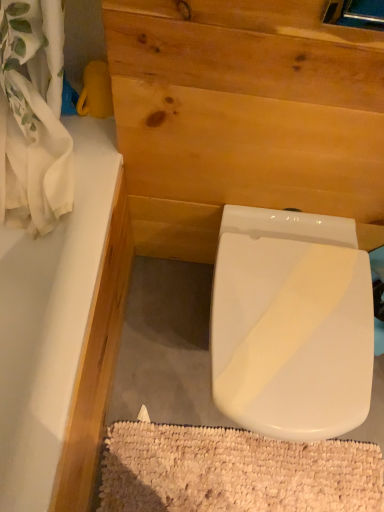
Question: From the image's perspective, is white textured bath mat at lower center located beneath natural wood plywood at center?

Choices:
 (A) no
 (B) yes

Answer: (B)

Question: Is white textured bath mat at lower center to the left of natural wood plywood at center from the viewer's perspective?

Choices:
 (A) yes
 (B) no

Answer: (A)

Question: Can you confirm if white textured bath mat at lower center is bigger than natural wood plywood at center?

Choices:
 (A) yes
 (B) no

Answer: (B)

Question: Does white textured bath mat at lower center have a greater height compared to natural wood plywood at center?

Choices:
 (A) no
 (B) yes

Answer: (A)

Question: Does white textured bath mat at lower center have a lesser height compared to natural wood plywood at center?

Choices:
 (A) yes
 (B) no

Answer: (A)

Question: From the image's perspective, is white glossy bathtub at upper left positioned above or below white textured bath mat at lower center?

Choices:
 (A) below
 (B) above

Answer: (B)

Question: Would you say white glossy bathtub at upper left is inside or outside white textured bath mat at lower center?

Choices:
 (A) outside
 (B) inside

Answer: (A)

Question: From a real-world perspective, is white glossy bathtub at upper left physically located above or below white textured bath mat at lower center?

Choices:
 (A) below
 (B) above

Answer: (B)

Question: Is white glossy bathtub at upper left wider or thinner than white textured bath mat at lower center?

Choices:
 (A) thin
 (B) wide

Answer: (B)

Question: Is natural wood plywood at center taller or shorter than white glossy bathtub at upper left?

Choices:
 (A) tall
 (B) short

Answer: (A)

Question: From a real-world perspective, is natural wood plywood at center above or below white glossy bathtub at upper left?

Choices:
 (A) below
 (B) above

Answer: (B)

Question: Considering their positions, is natural wood plywood at center located in front of or behind white glossy bathtub at upper left?

Choices:
 (A) behind
 (B) front

Answer: (B)

Question: Does point (301, 129) appear closer or farther from the camera than point (9, 467)?

Choices:
 (A) closer
 (B) farther

Answer: (B)

Question: Considering the positions of white glossy bathtub at upper left and natural wood plywood at center in the image, is white glossy bathtub at upper left bigger or smaller than natural wood plywood at center?

Choices:
 (A) big
 (B) small

Answer: (A)

Question: In terms of width, does white glossy bathtub at upper left look wider or thinner when compared to natural wood plywood at center?

Choices:
 (A) thin
 (B) wide

Answer: (B)